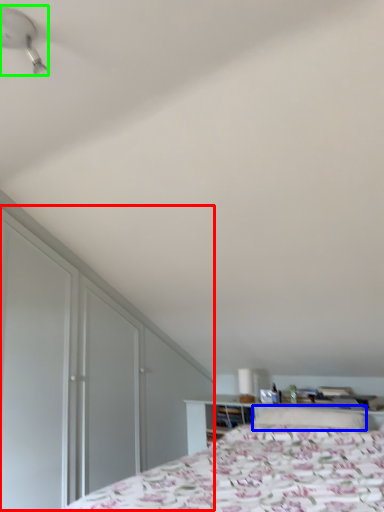
Question: Considering the real-world distances, which object is farthest from dresser (highlighted by a red box)? pillow (highlighted by a blue box) or fan (highlighted by a green box)?

Choices:
 (A) pillow
 (B) fan

Answer: (B)